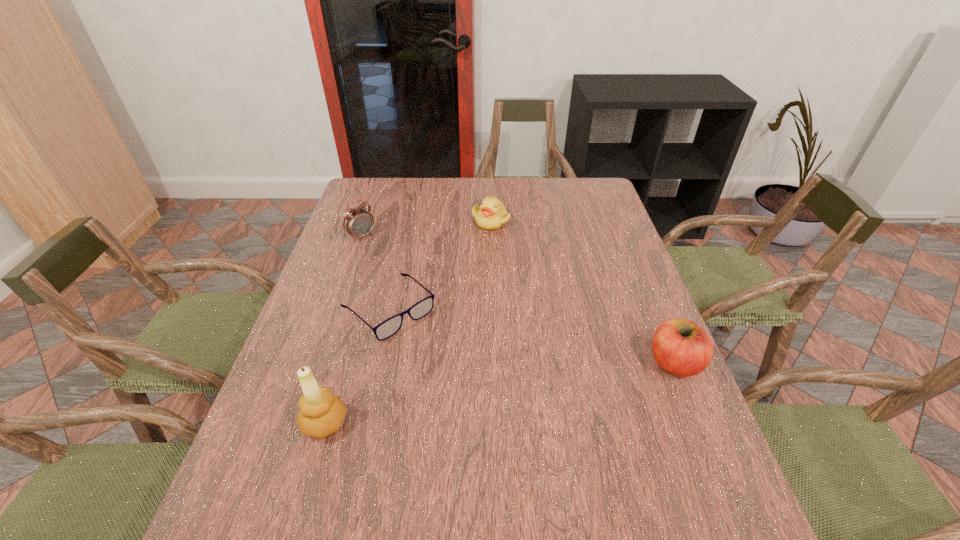
Identify the location of spectacles at the left edge. The width and height of the screenshot is (960, 540). (386, 329).

Where is `alarm clock at the left edge`? alarm clock at the left edge is located at coordinates (x=358, y=222).

You are a GUI agent. You are given a task and a screenshot of the screen. Output one action in this format:
    pyautogui.click(x=<x>, y=<y>)
    Task: Click on the object present at the right edge
    This screenshot has height=540, width=960.
    Given the screenshot: What is the action you would take?
    pyautogui.click(x=681, y=347)

You are a GUI agent. You are given a task and a screenshot of the screen. Output one action in this format:
    pyautogui.click(x=<x>, y=<y>)
    Task: Click on the free space at the far edge of the desktop
    
    Given the screenshot: What is the action you would take?
    pyautogui.click(x=404, y=204)

In the image, there is a desktop. Find the location of `vacant space at the near edge`. vacant space at the near edge is located at coordinates (345, 465).

You are a GUI agent. You are given a task and a screenshot of the screen. Output one action in this format:
    pyautogui.click(x=<x>, y=<y>)
    Task: Click on the vacant space at the left edge of the desktop
    
    Given the screenshot: What is the action you would take?
    pyautogui.click(x=347, y=246)

The image size is (960, 540). I want to click on vacant space at the right edge of the desktop, so click(x=598, y=286).

In order to click on vacant space at the far left corner of the desktop in this screenshot , I will do `click(364, 191)`.

This screenshot has width=960, height=540. Find the location of `vacant space at the far right corner of the desktop`. vacant space at the far right corner of the desktop is located at coordinates (564, 180).

At what (x,y) coordinates should I click in order to perform the action: click on blank space at the near right corner of the desktop. Please return your answer as a coordinate pair (x, y). This screenshot has height=540, width=960. Looking at the image, I should click on coord(668,460).